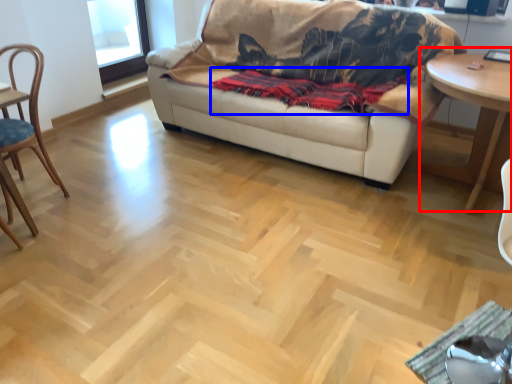
Question: Which object is closer to the camera taking this photo, table (highlighted by a red box) or blanket (highlighted by a blue box)?

Choices:
 (A) table
 (B) blanket

Answer: (A)